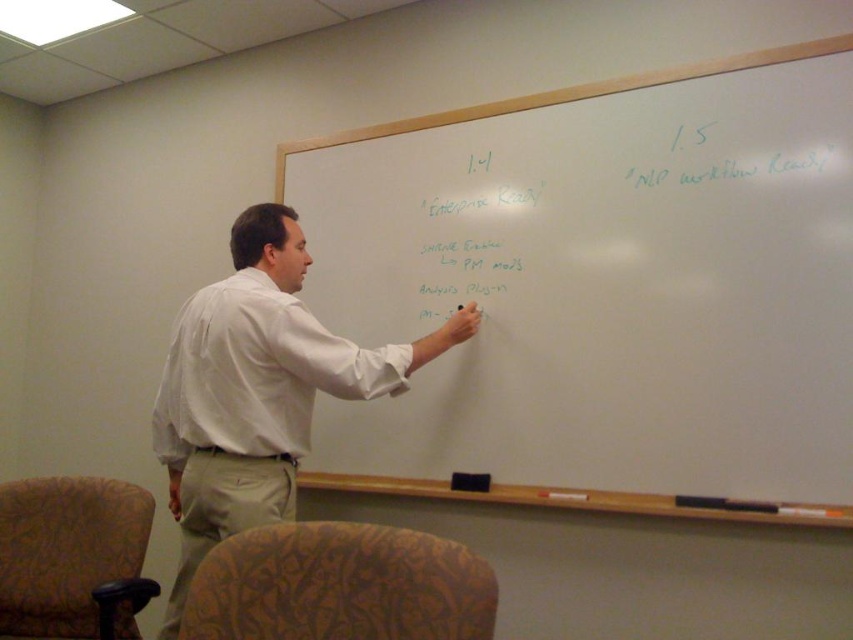
Which is more to the left, whiteboard at upper center or velvet-patterned armchair at lower left?

Positioned to the left is velvet-patterned armchair at lower left.

Between point (310, 211) and point (212, 552), which one is positioned in front?

Positioned in front is point (212, 552).

You are a GUI agent. You are given a task and a screenshot of the screen. Output one action in this format:
    pyautogui.click(x=<x>, y=<y>)
    Task: Click on the whiteboard at upper center
    The height and width of the screenshot is (640, 853).
    Given the screenshot: What is the action you would take?
    pyautogui.click(x=601, y=289)

Does white cotton shirt at center have a lesser width compared to patterned fabric armchair at lower left?

Incorrect, white cotton shirt at center's width is not less than patterned fabric armchair at lower left's.

Is point (193, 541) positioned after point (59, 545)?

No, (193, 541) is closer to viewer.

Locate an element on the screen. white cotton shirt at center is located at coordinates (259, 388).

Which of these two, white cotton shirt at center or velvet-patterned armchair at lower left, stands shorter?

Standing shorter between the two is velvet-patterned armchair at lower left.

The image size is (853, 640). Describe the element at coordinates (259, 388) in the screenshot. I see `white cotton shirt at center` at that location.

This screenshot has height=640, width=853. I want to click on white cotton shirt at center, so click(259, 388).